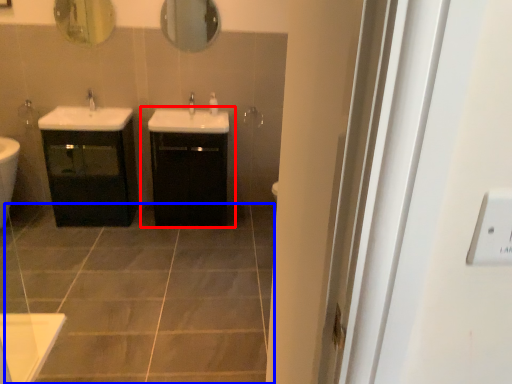
Question: Which object is further to the camera taking this photo, bathroom cabinet (highlighted by a red box) or ceramic tile (highlighted by a blue box)?

Choices:
 (A) bathroom cabinet
 (B) ceramic tile

Answer: (A)